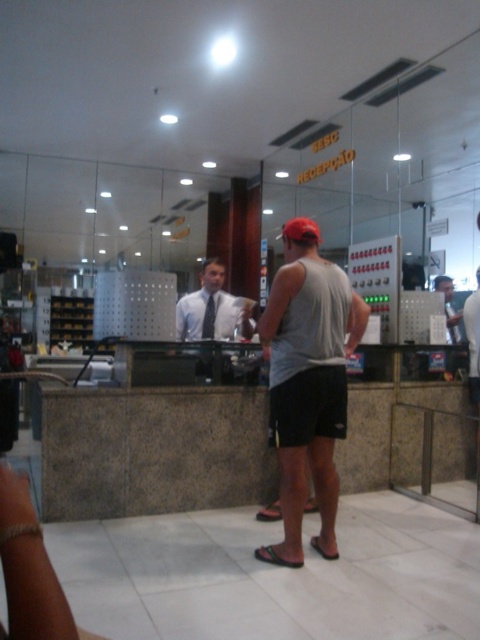
You are standing in the hotel lobby and see the gray matte tank top at center. If you want to approach it, how many steps of 0.75 meters each would you need to take to reach it?

The gray matte tank top at center is 2.90 meters away from the viewer. To reach it with steps of 0.75 meters each, you would need to take approximately 4 steps, as 4 steps multiplied by 0.75 meters equals 3 meters, which is slightly more than the required distance.

From the picture: What are the coordinates of the gray matte tank top at center?

The gray matte tank top at center is located at coordinates point (308, 381).

You are a guest at the hotel and want to speak to the receptionist. You see the gray matte tank top at center and the matte white shirt at center. Which one should you look at to address the receptionist?

You should look at the matte white shirt at center because the gray matte tank top at center is positioned under it, indicating it belongs to the receptionist standing behind the desk.